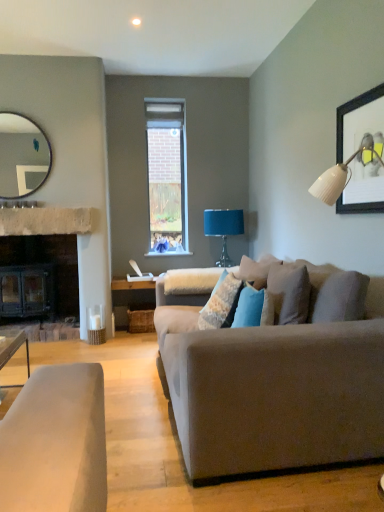
Locate an element on the screen. This screenshot has width=384, height=512. matte silver mirror at upper left is located at coordinates (22, 156).

Describe the element at coordinates (278, 374) in the screenshot. I see `suede couch at center` at that location.

This screenshot has width=384, height=512. What do you see at coordinates (221, 304) in the screenshot?
I see `textured blue pillow at center` at bounding box center [221, 304].

This screenshot has height=512, width=384. Identify the location of teal fabric lampshade at upper right. (223, 229).

The width and height of the screenshot is (384, 512). I want to click on natural stone mantle at left, so click(x=48, y=221).

Between point (225, 211) and point (58, 225), which one is positioned in front?

Positioned in front is point (58, 225).

How many degrees apart are the facing directions of teal fabric lampshade at upper right and natural stone mantle at left?

The angular difference between teal fabric lampshade at upper right and natural stone mantle at left is 3.08 degrees.

Identify the location of table lamp that is under the natural stone mantle at left (from a real-world perspective). point(223,229).

From the picture: From the image's perspective, is wooden framed artwork at upper right on matte silver mirror at upper left?

Actually, wooden framed artwork at upper right appears below matte silver mirror at upper left in the image.

Which object is positioned more to the left, wooden framed artwork at upper right or matte silver mirror at upper left?

matte silver mirror at upper left.

Is matte silver mirror at upper left surrounded by wooden framed artwork at upper right?

No.

Is wooden framed artwork at upper right far away from matte silver mirror at upper left?

Yes, wooden framed artwork at upper right and matte silver mirror at upper left are quite far apart.

Is matte silver mirror at upper left smaller than suede couch at center?

Yes.

From the image's perspective, does matte silver mirror at upper left appear lower than suede couch at center?

Actually, matte silver mirror at upper left appears above suede couch at center in the image.

Is matte silver mirror at upper left touching suede couch at center?

No.

How different are the orientations of matte silver mirror at upper left and suede couch at center in degrees?

There is a 89.4-degree angle between the facing directions of matte silver mirror at upper left and suede couch at center.

Considering the sizes of objects textured blue pillow at center and wooden framed artwork at upper right in the image provided, who is shorter, textured blue pillow at center or wooden framed artwork at upper right?

textured blue pillow at center.

Where is `picture frame above the textured blue pillow at center (from the image's perspective)`? The image size is (384, 512). picture frame above the textured blue pillow at center (from the image's perspective) is located at coordinates (359, 121).

Is textured blue pillow at center far away from wooden framed artwork at upper right?

Absolutely, textured blue pillow at center is distant from wooden framed artwork at upper right.

Considering the relative positions of suede couch at center and matte silver mirror at upper left in the image provided, is suede couch at center in front of matte silver mirror at upper left?

Yes, the depth of suede couch at center is less than that of matte silver mirror at upper left.

Is suede couch at center far from matte silver mirror at upper left?

That's right, there is a large distance between suede couch at center and matte silver mirror at upper left.

Is suede couch at center situated inside matte silver mirror at upper left or outside?

suede couch at center is outside matte silver mirror at upper left.

Which of these two, suede couch at center or matte silver mirror at upper left, stands shorter?

matte silver mirror at upper left is shorter.

From the image's perspective, does wooden framed artwork at upper right appear higher than suede couch at center?

Yes.

Is wooden framed artwork at upper right next to suede couch at center?

There is a gap between wooden framed artwork at upper right and suede couch at center.

From a real-world perspective, is wooden framed artwork at upper right located beneath suede couch at center?

No, from a real-world perspective, wooden framed artwork at upper right is not beneath suede couch at center.

Between wooden framed artwork at upper right and suede couch at center, which one has smaller size?

wooden framed artwork at upper right.

You are a GUI agent. You are given a task and a screenshot of the screen. Output one action in this format:
    pyautogui.click(x=<x>, y=<y>)
    Task: Click on the picture frame above the teal fabric lampshade at upper right (from the image's perspective)
    Image resolution: width=384 pixels, height=512 pixels.
    Given the screenshot: What is the action you would take?
    pyautogui.click(x=359, y=121)

Is point (381, 87) positioned in front of point (213, 217)?

Yes, it is in front of point (213, 217).

Consider the image. Is wooden framed artwork at upper right directly adjacent to teal fabric lampshade at upper right?

There is a gap between wooden framed artwork at upper right and teal fabric lampshade at upper right.

Considering the relative sizes of wooden framed artwork at upper right and teal fabric lampshade at upper right in the image provided, is wooden framed artwork at upper right thinner than teal fabric lampshade at upper right?

Yes, wooden framed artwork at upper right is thinner than teal fabric lampshade at upper right.

Image resolution: width=384 pixels, height=512 pixels. Identify the location of mantle above the teal fabric lampshade at upper right (from the image's perspective). (48, 221).

Image resolution: width=384 pixels, height=512 pixels. Find the location of `picture frame on the right of matte silver mirror at upper left`. picture frame on the right of matte silver mirror at upper left is located at coordinates (359, 121).

Looking at the image, which one is located closer to wooden framed artwork at upper right, teal fabric lampshade at upper right or textured blue pillow at center?

textured blue pillow at center lies closer to wooden framed artwork at upper right than the other object.

Based on the photo, when comparing their distances from teal fabric lampshade at upper right, does matte silver mirror at upper left or suede couch at center seem closer?

Among the two, matte silver mirror at upper left is located nearer to teal fabric lampshade at upper right.

From the image, which object appears to be farther from textured blue pillow at center, suede couch at center or wooden framed artwork at upper right?

wooden framed artwork at upper right.

Which object lies further to the anchor point textured blue pillow at center, suede couch at center or teal fabric lampshade at upper right?

Among the two, teal fabric lampshade at upper right is located further to textured blue pillow at center.

Considering their positions, is wooden framed artwork at upper right positioned closer to textured blue pillow at center than teal fabric lampshade at upper right?

Based on the image, wooden framed artwork at upper right appears to be nearer to textured blue pillow at center.

Consider the image. Considering their positions, is matte silver mirror at upper left positioned further to natural stone mantle at left than textured blue pillow at center?

The object further to natural stone mantle at left is textured blue pillow at center.

Considering their positions, is teal fabric lampshade at upper right positioned further to textured blue pillow at center than suede couch at center?

The object further to textured blue pillow at center is teal fabric lampshade at upper right.

When comparing their distances from natural stone mantle at left, does teal fabric lampshade at upper right or matte silver mirror at upper left seem further?

teal fabric lampshade at upper right is positioned further to the anchor natural stone mantle at left.

I want to click on pillow between matte silver mirror at upper left and teal fabric lampshade at upper right from left to right, so click(221, 304).

Identify the location of mirror between suede couch at center and natural stone mantle at left in the front-back direction. (22, 156).

The width and height of the screenshot is (384, 512). Find the location of `picture frame between suede couch at center and textured blue pillow at center from front to back`. picture frame between suede couch at center and textured blue pillow at center from front to back is located at coordinates (359, 121).

Where is `pillow located between matte silver mirror at upper left and suede couch at center in the left-right direction`? pillow located between matte silver mirror at upper left and suede couch at center in the left-right direction is located at coordinates (221, 304).